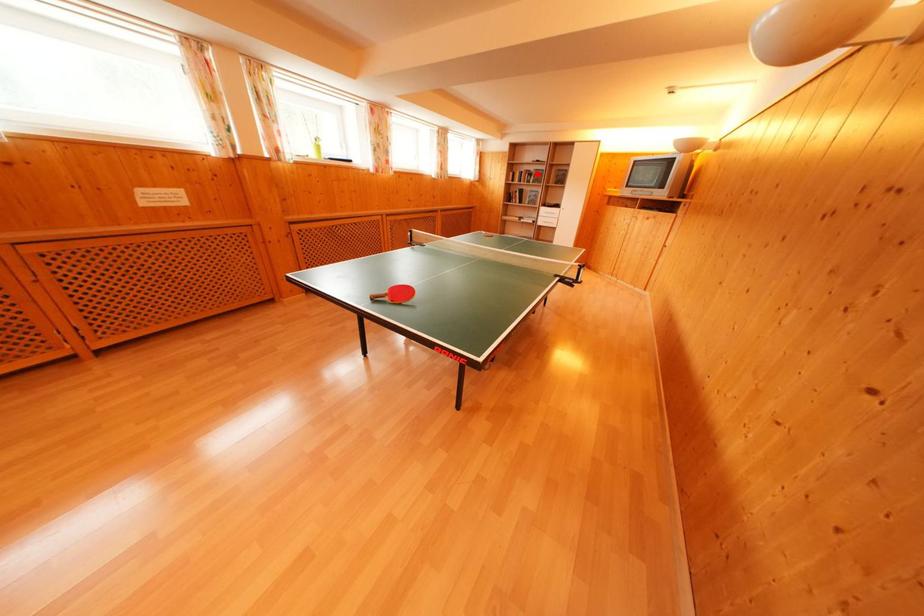
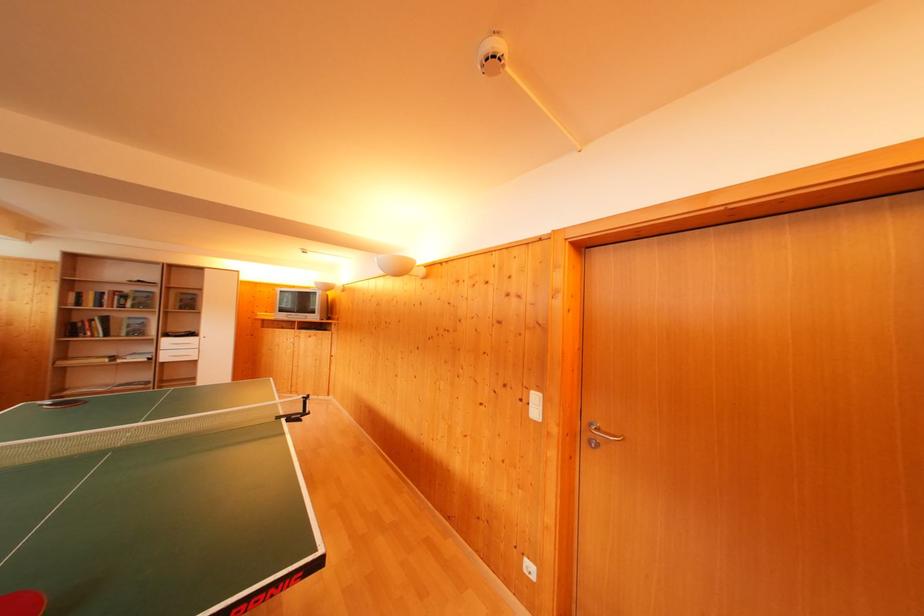
Question: I am providing you with two images of the same scene from different viewpoints. Image1 has a red point marked. In image2, the corresponding 3D location appears at what relative position? Reply with the corresponding letter.

Choices:
 (A) Closer
 (B) Farther

Answer: (B)